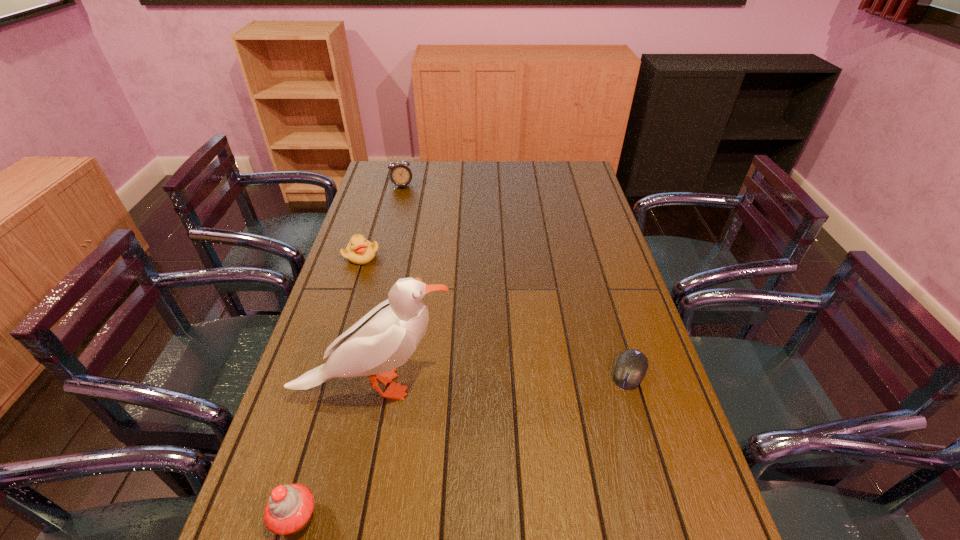
The width and height of the screenshot is (960, 540). I want to click on object at the right edge, so click(x=632, y=364).

In order to click on object at the far left corner in this screenshot , I will do `click(400, 174)`.

In the image, there is a desktop. Where is `free region at the far edge`? free region at the far edge is located at coordinates (546, 164).

This screenshot has width=960, height=540. I want to click on free region at the near edge, so click(351, 489).

Image resolution: width=960 pixels, height=540 pixels. In the image, there is a desktop. In order to click on vacant space at the left edge in this screenshot , I will do `click(349, 283)`.

Locate an element on the screen. The height and width of the screenshot is (540, 960). free space at the right edge of the desktop is located at coordinates (588, 247).

Locate an element on the screen. free region at the far right corner of the desktop is located at coordinates (559, 168).

The width and height of the screenshot is (960, 540). In the image, there is a desktop. In order to click on vacant space at the near right corner in this screenshot , I will do `click(650, 491)`.

In order to click on free area in between the tallest object and the rightmost object in this screenshot , I will do `click(503, 377)`.

In order to click on unoccupied area between the shortest object and the gull in this screenshot , I will do `click(503, 377)`.